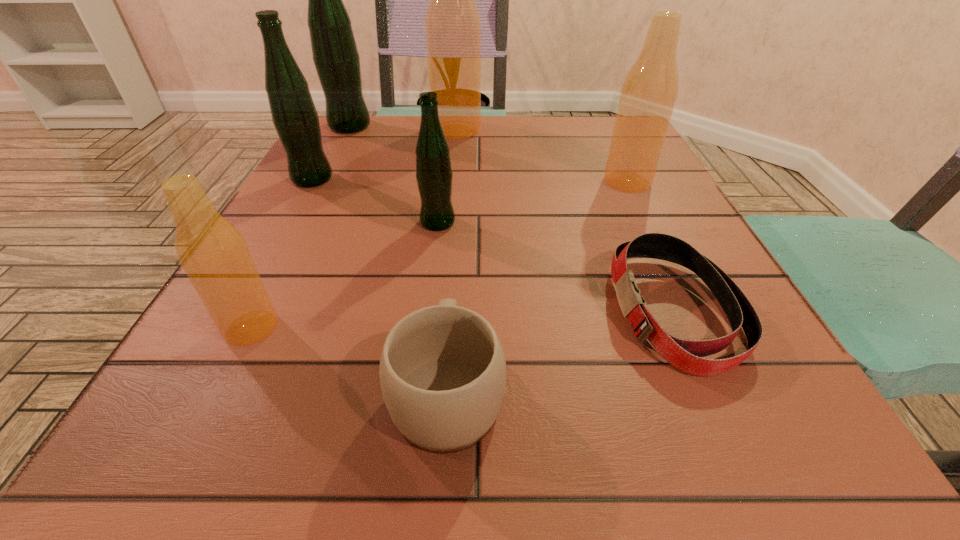
Find the location of a particular element. vacant space at the far left corner of the desktop is located at coordinates (389, 119).

I want to click on free space at the near left corner, so click(x=228, y=447).

The height and width of the screenshot is (540, 960). Find the location of `free location at the far right corner of the desktop`. free location at the far right corner of the desktop is located at coordinates (576, 119).

The height and width of the screenshot is (540, 960). What are the coordinates of `empty space between the biggest tan beer bottle and the mug` in the screenshot? It's located at (452, 259).

At what (x,y) coordinates should I click in order to perform the action: click on free space that is in between the dog collar and the second shortest object. Please return your answer as a coordinate pair (x, y). The height and width of the screenshot is (540, 960). Looking at the image, I should click on (561, 350).

Find the location of a particular element. The image size is (960, 540). empty space between the nearest green beer bottle and the leftmost tan beer bottle is located at coordinates (345, 275).

Image resolution: width=960 pixels, height=540 pixels. I want to click on vacant space that's between the second tan beer bottle from left to right and the rightmost tan beer bottle, so click(x=542, y=156).

This screenshot has width=960, height=540. I want to click on free space between the shortest object and the biggest tan beer bottle, so click(565, 220).

Find the location of a particular element. This screenshot has height=540, width=960. vacant space in between the mug and the second smallest green beer bottle is located at coordinates (380, 284).

Where is `unoccupied area between the rightmost tan beer bottle and the leftmost tan beer bottle`? The height and width of the screenshot is (540, 960). unoccupied area between the rightmost tan beer bottle and the leftmost tan beer bottle is located at coordinates point(440,255).